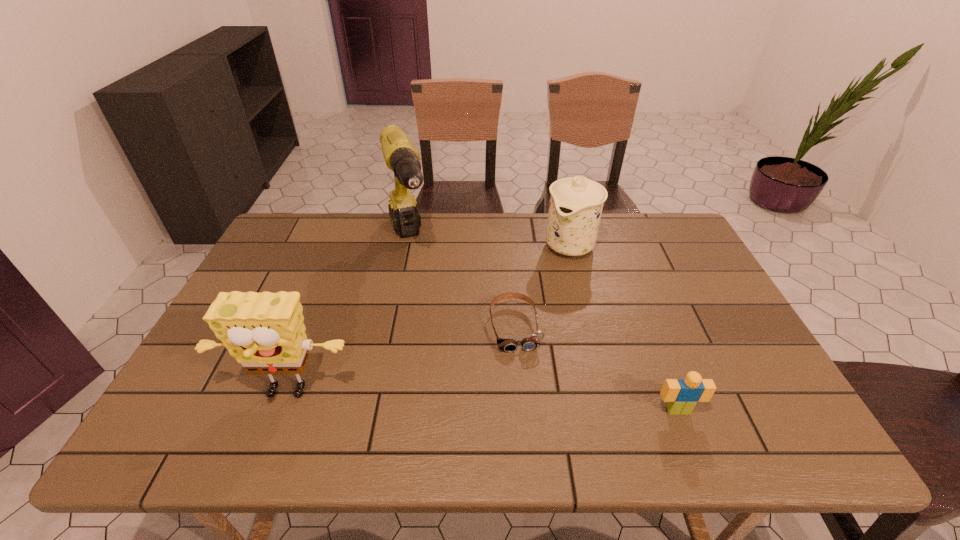
Locate an element on the screen. The width and height of the screenshot is (960, 540). object that is at the near left corner is located at coordinates (265, 332).

Locate an element on the screen. vacant space at the far edge is located at coordinates (453, 222).

The image size is (960, 540). I want to click on vacant space at the near edge, so click(339, 392).

Find the location of `vacant region at the left edge of the desktop`. vacant region at the left edge of the desktop is located at coordinates (276, 286).

This screenshot has width=960, height=540. What are the coordinates of `free location at the right edge` in the screenshot? It's located at (668, 258).

Where is `free space at the far left corner of the desktop`? free space at the far left corner of the desktop is located at coordinates (297, 250).

The image size is (960, 540). Identify the location of vacant region at the far right corner of the desktop. click(647, 219).

Where is `blank region between the drill and the chinaware`? The image size is (960, 540). blank region between the drill and the chinaware is located at coordinates (489, 243).

In order to click on vacant area that lies between the shortest object and the fourth tallest object in this screenshot , I will do point(596,369).

Find the location of `free spot between the second object from right to left and the sponge`. free spot between the second object from right to left and the sponge is located at coordinates (427, 319).